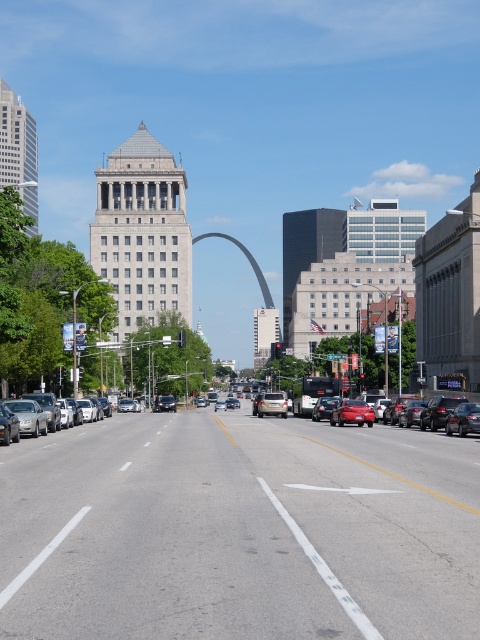
Question: Does shiny red car at center appear on the right side of silver metallic suv at center?

Choices:
 (A) yes
 (B) no

Answer: (A)

Question: Considering the real-world distances, which object is closest to the shiny black sedan at right?

Choices:
 (A) silver metallic suv at center
 (B) silver metallic sedan at center

Answer: (A)

Question: Is silver metallic suv at center above matte black bus at center?

Choices:
 (A) yes
 (B) no

Answer: (A)

Question: Which object is closer to the camera taking this photo?

Choices:
 (A) matte silver sedan at center
 (B) shiny red car at center

Answer: (B)

Question: Does shiny red car at center have a smaller size compared to silver metallic sedan at center?

Choices:
 (A) yes
 (B) no

Answer: (A)

Question: Among these points, which one is farthest from the camera?

Choices:
 (A) (475, 424)
 (B) (120, 404)

Answer: (B)